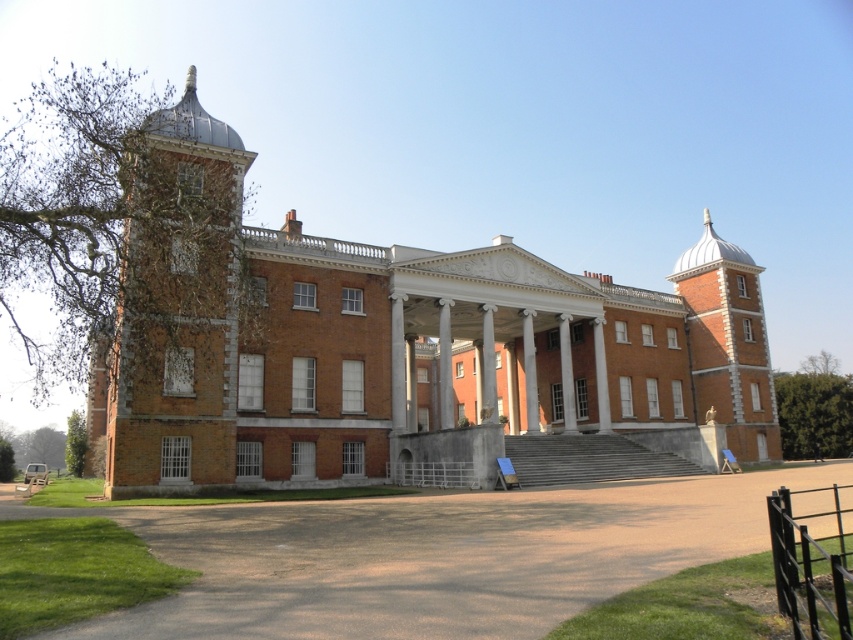
Who is lower down, brown gravel driveway at lower center or brick stonework bell tower at left?

brown gravel driveway at lower center is below.

Does brown gravel driveway at lower center appear on the right side of brick stonework bell tower at left?

Correct, you'll find brown gravel driveway at lower center to the right of brick stonework bell tower at left.

At what (x,y) coordinates should I click in order to perform the action: click on brown gravel driveway at lower center. Please return your answer as a coordinate pair (x, y). This screenshot has height=640, width=853. Looking at the image, I should click on (434, 556).

Does point (689, 326) come behind point (561, 388)?

Yes, point (689, 326) is farther from viewer.

Who is taller, brick stonework bell tower at right or white marble pillar at center?

Standing taller between the two is brick stonework bell tower at right.

Image resolution: width=853 pixels, height=640 pixels. What are the coordinates of `brick stonework bell tower at right` in the screenshot? It's located at (728, 344).

Is brick stonework bell tower at left bigger than brick stonework bell tower at right?

Incorrect, brick stonework bell tower at left is not larger than brick stonework bell tower at right.

In order to click on brick stonework bell tower at left in this screenshot , I will do click(x=177, y=305).

Find the location of `brick stonework bell tower at left`. brick stonework bell tower at left is located at coordinates (177, 305).